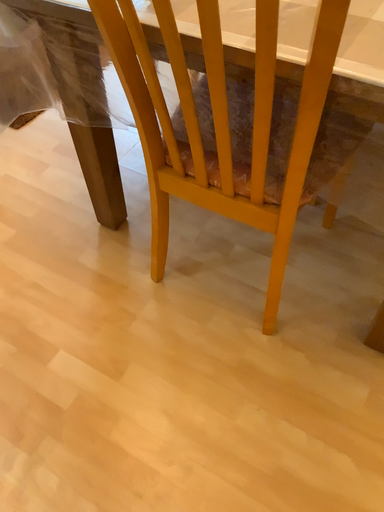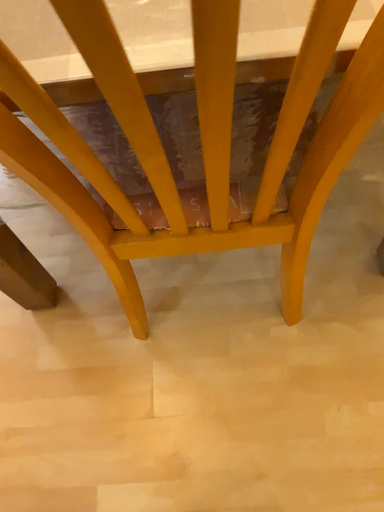
Question: How did the camera likely rotate when shooting the video?

Choices:
 (A) rotated left
 (B) rotated right

Answer: (B)